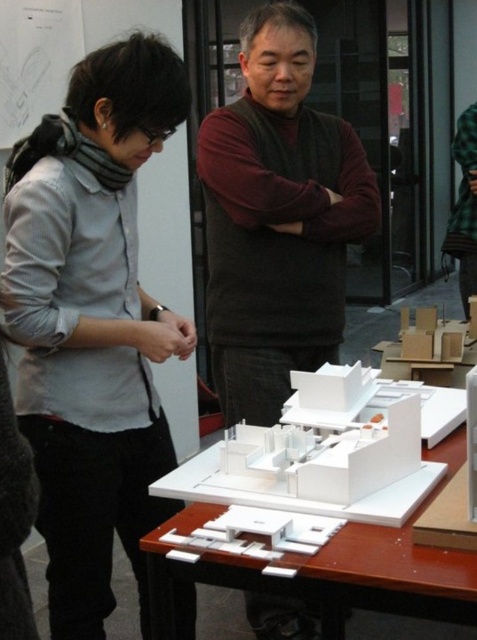
Can you confirm if matte gray shirt at left is taller than white matte table at center?

Indeed, matte gray shirt at left has a greater height compared to white matte table at center.

Can you confirm if matte gray shirt at left is shorter than white matte table at center?

No.

Describe the element at coordinates (93, 323) in the screenshot. I see `matte gray shirt at left` at that location.

Where is `matte gray shirt at left`? Image resolution: width=477 pixels, height=640 pixels. matte gray shirt at left is located at coordinates (93, 323).

Which is more to the right, matte gray shirt at left or green plaid shirt at center?

Positioned to the right is green plaid shirt at center.

This screenshot has height=640, width=477. I want to click on matte gray shirt at left, so click(x=93, y=323).

Which is above, matte gray shirt at left or matte brown sweater at center?

Positioned higher is matte brown sweater at center.

Is matte gray shirt at left wider than matte brown sweater at center?

No.

Which is in front, point (121, 365) or point (300, 131)?

Point (121, 365) is more forward.

The width and height of the screenshot is (477, 640). What are the coordinates of `matte gray shirt at left` in the screenshot? It's located at (93, 323).